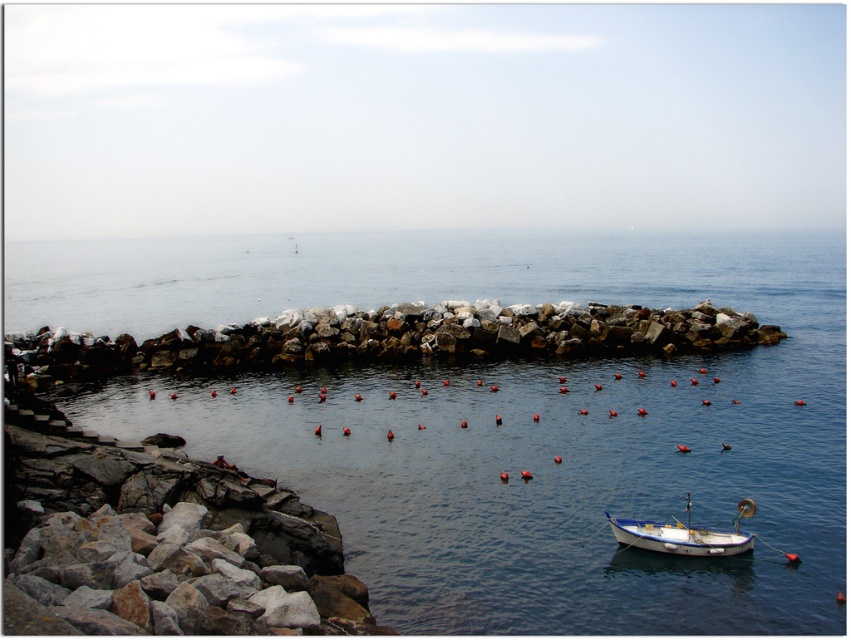
Does blue water at center lie behind rockyrough stonerocky barrier at center?

No, it is in front of rockyrough stonerocky barrier at center.

Which is in front, point (429, 291) or point (270, 332)?

Point (270, 332)

Where is `blue water at center`? blue water at center is located at coordinates (507, 419).

Is rockyrough stonerocky barrier at center wider than blue polished wood boat at lower right?

Yes, rockyrough stonerocky barrier at center is wider than blue polished wood boat at lower right.

Between point (254, 340) and point (618, 529), which one is positioned in front?

Positioned in front is point (618, 529).

Image resolution: width=851 pixels, height=640 pixels. Find the location of `rockyrough stonerocky barrier at center`. rockyrough stonerocky barrier at center is located at coordinates (387, 339).

Between blue water at center and blue polished wood boat at lower right, which one appears on the right side from the viewer's perspective?

blue polished wood boat at lower right

Is blue water at center shorter than blue polished wood boat at lower right?

No, blue water at center is not shorter than blue polished wood boat at lower right.

Is point (404, 275) positioned before point (721, 536)?

No, (404, 275) is further to viewer.

Where is `blue water at center`? The image size is (851, 640). blue water at center is located at coordinates (507, 419).